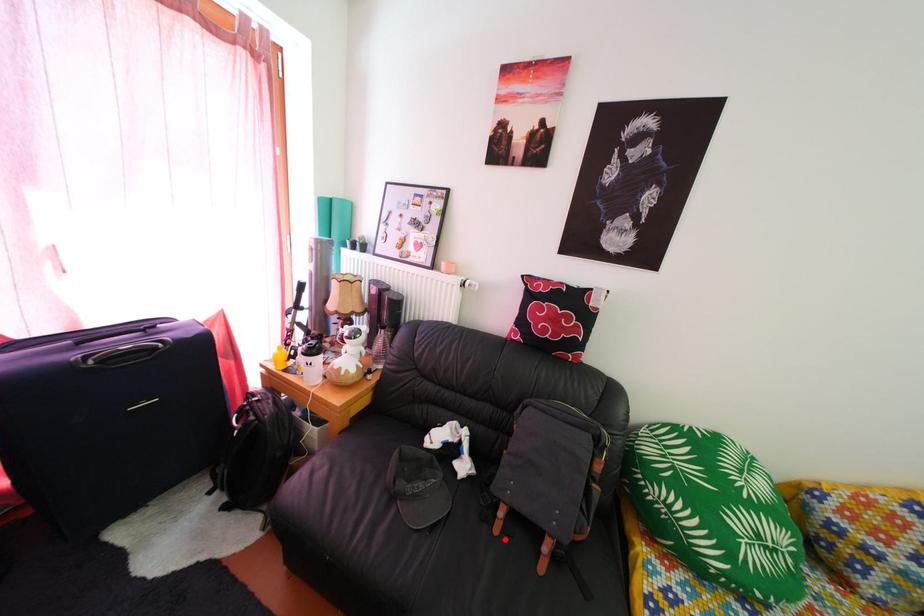
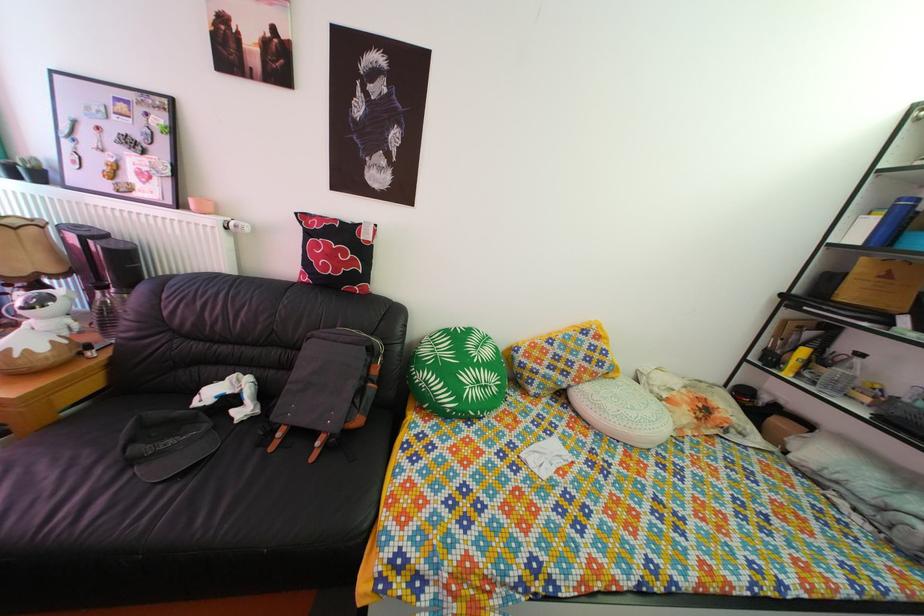
Locate, in the second image, the point that corresponds to the highlighted location in the first image.

(281, 456)